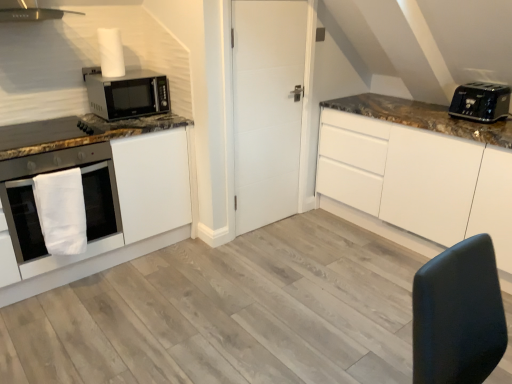
Question: Does white matte cabinet at upper right, which ranks as the first cabinetry in right-to-left order, come behind black plastic toaster at upper right?

Choices:
 (A) yes
 (B) no

Answer: (B)

Question: From the image's perspective, does white matte cabinet at upper right, positioned as the 2th cabinetry in left-to-right order, appear lower than black plastic toaster at upper right?

Choices:
 (A) no
 (B) yes

Answer: (B)

Question: Considering the relative sizes of white matte cabinet at upper right, which ranks as the first cabinetry in right-to-left order, and black plastic toaster at upper right in the image provided, is white matte cabinet at upper right, which ranks as the first cabinetry in right-to-left order, bigger than black plastic toaster at upper right?

Choices:
 (A) no
 (B) yes

Answer: (B)

Question: Can you see white matte cabinet at upper right, positioned as the 2th cabinetry in left-to-right order, touching black plastic toaster at upper right?

Choices:
 (A) no
 (B) yes

Answer: (A)

Question: Considering the relative sizes of white matte cabinet at upper right, positioned as the 2th cabinetry in left-to-right order, and black plastic toaster at upper right in the image provided, is white matte cabinet at upper right, positioned as the 2th cabinetry in left-to-right order, shorter than black plastic toaster at upper right?

Choices:
 (A) no
 (B) yes

Answer: (A)

Question: Does white matte cabinet at upper right, which ranks as the first cabinetry in right-to-left order, have a smaller size compared to black plastic toaster at upper right?

Choices:
 (A) yes
 (B) no

Answer: (B)

Question: Does white matte door at center come behind white matte cabinet at upper right, which ranks as the first cabinetry in right-to-left order?

Choices:
 (A) yes
 (B) no

Answer: (A)

Question: Is white matte door at center facing away from white matte cabinet at upper right, which ranks as the first cabinetry in right-to-left order?

Choices:
 (A) no
 (B) yes

Answer: (A)

Question: Considering the relative sizes of white matte door at center and white matte cabinet at upper right, which ranks as the first cabinetry in right-to-left order, in the image provided, is white matte door at center bigger than white matte cabinet at upper right, which ranks as the first cabinetry in right-to-left order,?

Choices:
 (A) no
 (B) yes

Answer: (A)

Question: Does white matte door at center appear on the right side of white matte cabinet at upper right, which ranks as the first cabinetry in right-to-left order?

Choices:
 (A) no
 (B) yes

Answer: (A)

Question: Is white matte door at center taller than white matte cabinet at upper right, which ranks as the first cabinetry in right-to-left order?

Choices:
 (A) no
 (B) yes

Answer: (B)

Question: From a real-world perspective, is white matte door at center on white matte cabinet at upper right, positioned as the 2th cabinetry in left-to-right order?

Choices:
 (A) yes
 (B) no

Answer: (A)

Question: Is matte black microwave at upper left behind black plastic toaster at upper right?

Choices:
 (A) yes
 (B) no

Answer: (A)